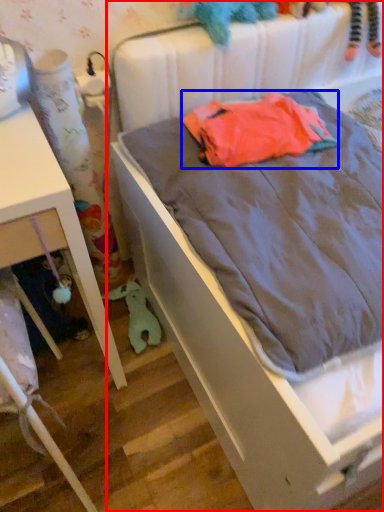
Question: Which of the following is the farthest to the observer, bed (highlighted by a red box) or baby clothe (highlighted by a blue box)?

Choices:
 (A) bed
 (B) baby clothe

Answer: (B)